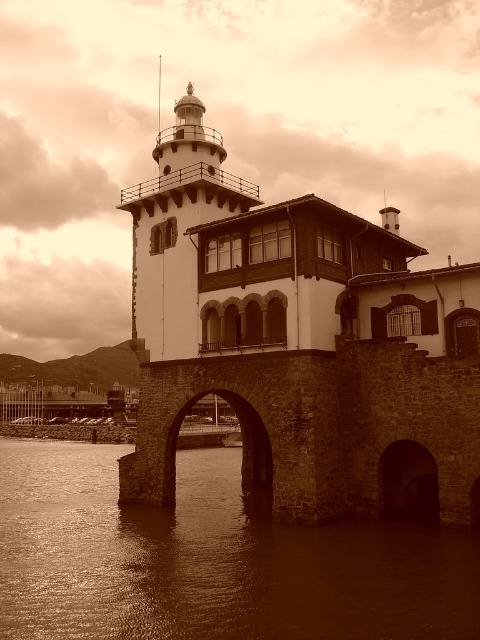
You are standing at the base of the lighthouse and looking towards the two points marked in the image. Which point, point (x=12, y=588) or point (x=196, y=136), is closer to you?

Point (x=12, y=588) is closer to you than point (x=196, y=136).